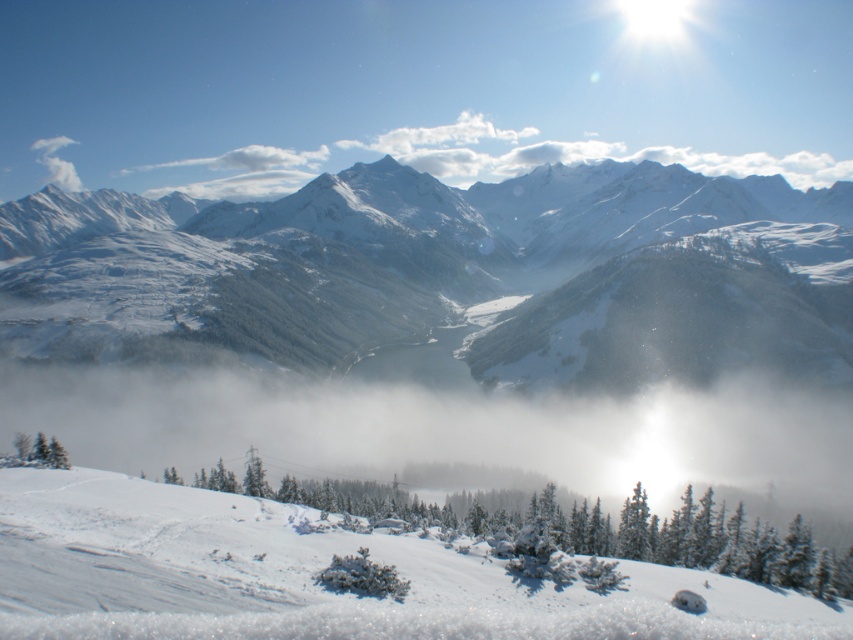
Question: Estimate the real-world distances between objects in this image. Which object is closer to the white snow ski slope at lower left?

Choices:
 (A) white fluffy cloud at upper left
 (B) white snow-covered mountain range at upper center

Answer: (B)

Question: Is white snow-covered mountain range at upper center positioned at the back of white fluffy cloud at upper left?

Choices:
 (A) yes
 (B) no

Answer: (B)

Question: Which of the following is the closest to the observer?

Choices:
 (A) (73, 188)
 (B) (291, 294)
 (C) (47, 593)

Answer: (C)

Question: Which object is the farthest from the white snow-covered mountain range at upper center?

Choices:
 (A) white snow ski slope at lower left
 (B) white fluffy cloud at upper left

Answer: (B)

Question: Is white snow ski slope at lower left bigger than white fluffy cloud at upper left?

Choices:
 (A) yes
 (B) no

Answer: (B)

Question: Does white snow ski slope at lower left have a lesser width compared to white fluffy cloud at upper left?

Choices:
 (A) yes
 (B) no

Answer: (B)